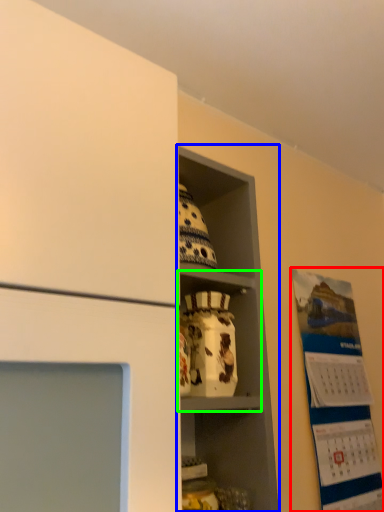
Question: Based on their relative distances, which object is farther from bulletin board (highlighted by a red box)? Choose from shelf (highlighted by a blue box) and cabinet (highlighted by a green box).

Choices:
 (A) shelf
 (B) cabinet

Answer: (B)